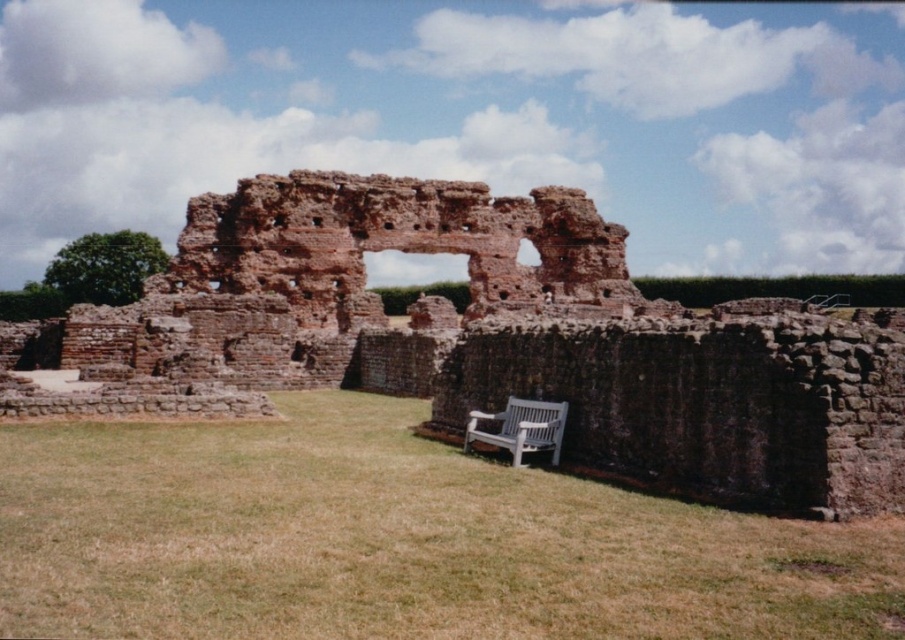
You are standing at the entrance of the ancient structure and want to take a photo of the brown stone ruins at center. Where should you position yourself to capture the ruins in the center of your camera frame?

You should position yourself directly in front of the brown stone ruins at center at point coordinates approximately (505, 339) to ensure they are centered in your camera frame.

You are a tourist visiting the ancient site and want to sit on the white wooden bench at lower center to take a photo of the brown stone ruins at center. Is the bench positioned in a way that allows you to see the ruins clearly?

The brown stone ruins at center is positioned over white wooden bench at lower center, so the bench is placed directly under the ruins. This means the ruins are above the bench, so you can clearly see them while sitting there.